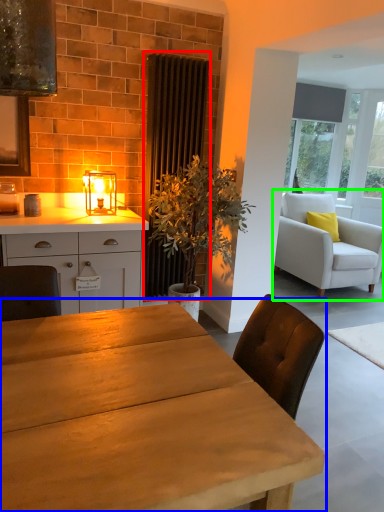
Question: Which is nearer to the curtain (highlighted by a red box)? table (highlighted by a blue box) or chair (highlighted by a green box).

Choices:
 (A) table
 (B) chair

Answer: (B)